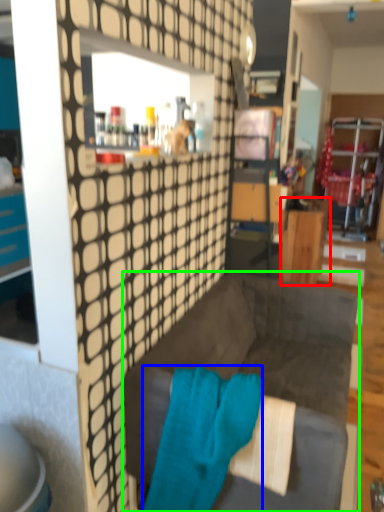
Question: Which object is positioned farthest from desk (highlighted by a red box)? Select from bath towel (highlighted by a blue box) and studio couch (highlighted by a green box).

Choices:
 (A) bath towel
 (B) studio couch

Answer: (A)